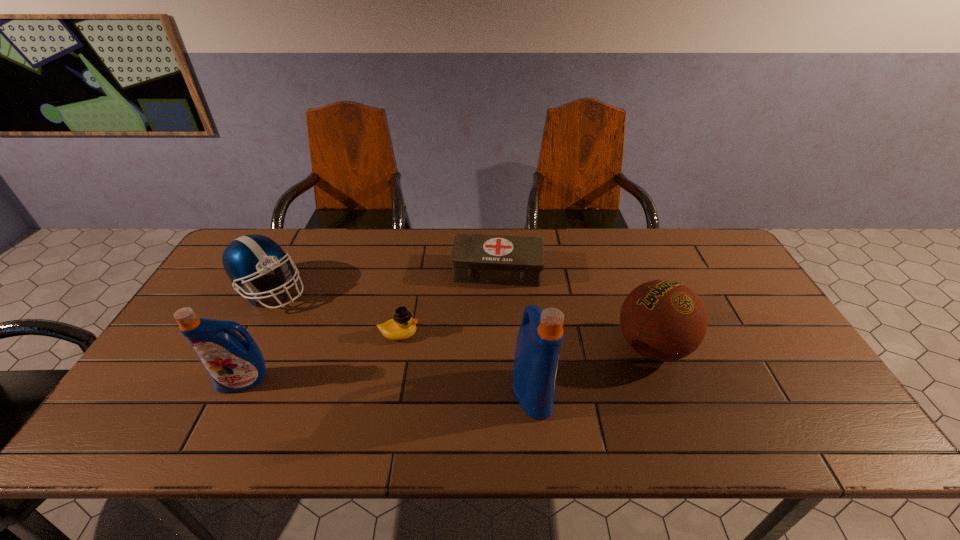
Considering the uniform spacing of detergents, where should an additional detergent be positioned on the right? Please locate a free spot. Please provide its 2D coordinates. Your answer should be formatted as a tuple, i.e. [(x, y)], where the tuple contains the x and y coordinates of a point satisfying the conditions above.

[(832, 402)]